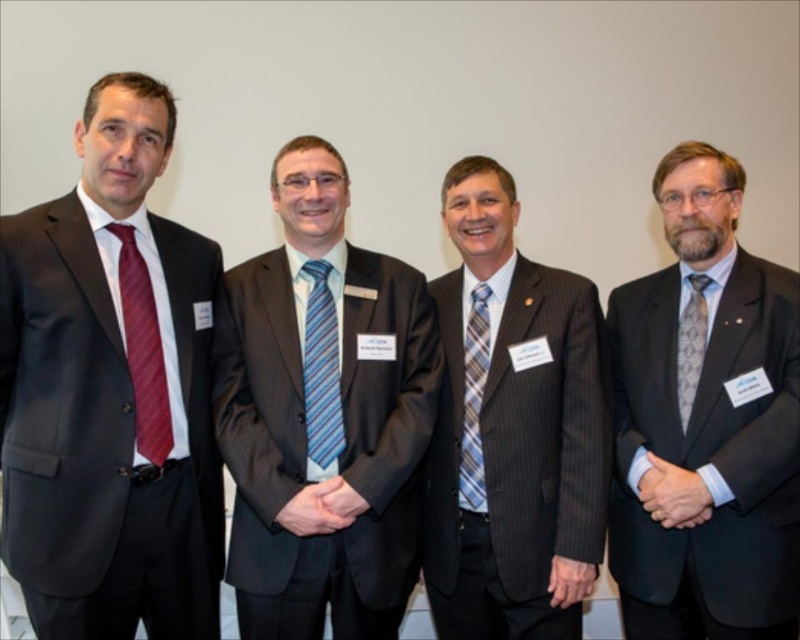
Who is positioned more to the left, dark gray suit at center or blue striped tie at center?

blue striped tie at center is more to the left.

Is dark gray suit at center behind blue striped tie at center?

No.

Does point (316, 573) come behind point (308, 424)?

That is False.

The image size is (800, 640). In order to click on dark gray suit at center in this screenshot , I will do `click(324, 416)`.

Does point (724, 200) lie in front of point (478, 321)?

That is True.

Looking at this image, which is more to the right, matte gray suit at right or blue plaid tie at center?

Positioned to the right is matte gray suit at right.

Is point (717, 307) farther from camera compared to point (470, 472)?

No, (717, 307) is in front of (470, 472).

Identify the location of matte gray suit at right. The image size is (800, 640). (705, 422).

Is point (364, 301) positioned after point (762, 285)?

Yes, point (364, 301) is farther from viewer.

Is dark gray suit at center behind matte gray suit at right?

Yes, it is.

Identify the location of dark gray suit at center. The image size is (800, 640). (324, 416).